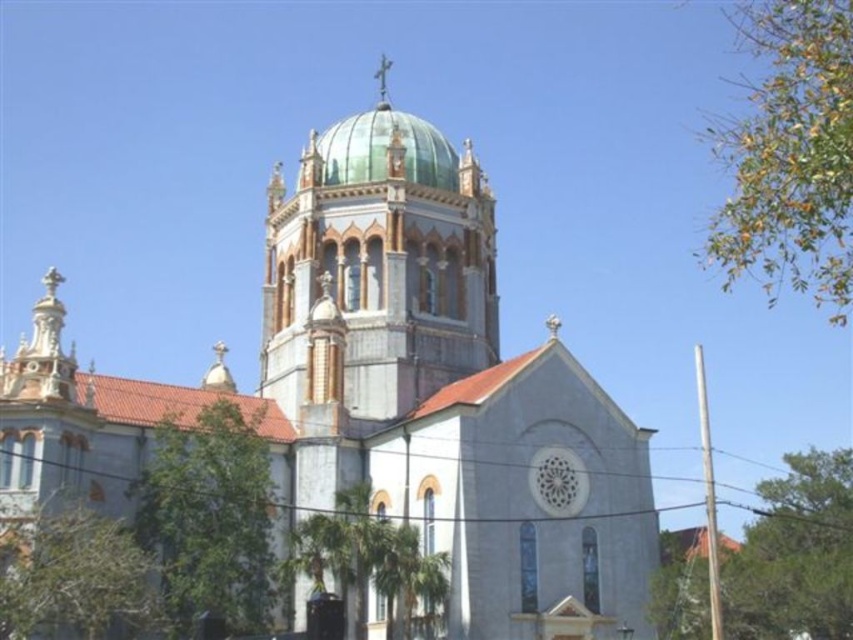
Question: Among these objects, which one is farthest from the camera?

Choices:
 (A) white stone church at center
 (B) green glass dome at upper center
 (C) green glass dome at center

Answer: (B)

Question: Which object is farther from the camera taking this photo?

Choices:
 (A) white stone church at center
 (B) green glass dome at upper center

Answer: (B)

Question: Among these objects, which one is farthest from the camera?

Choices:
 (A) green glass dome at center
 (B) white stone church at center
 (C) green glass dome at upper center

Answer: (C)

Question: Does green glass dome at center appear over green glass dome at upper center?

Choices:
 (A) yes
 (B) no

Answer: (B)

Question: Is white stone church at center positioned at the back of green glass dome at center?

Choices:
 (A) yes
 (B) no

Answer: (B)

Question: Can you confirm if white stone church at center is wider than green glass dome at upper center?

Choices:
 (A) yes
 (B) no

Answer: (A)